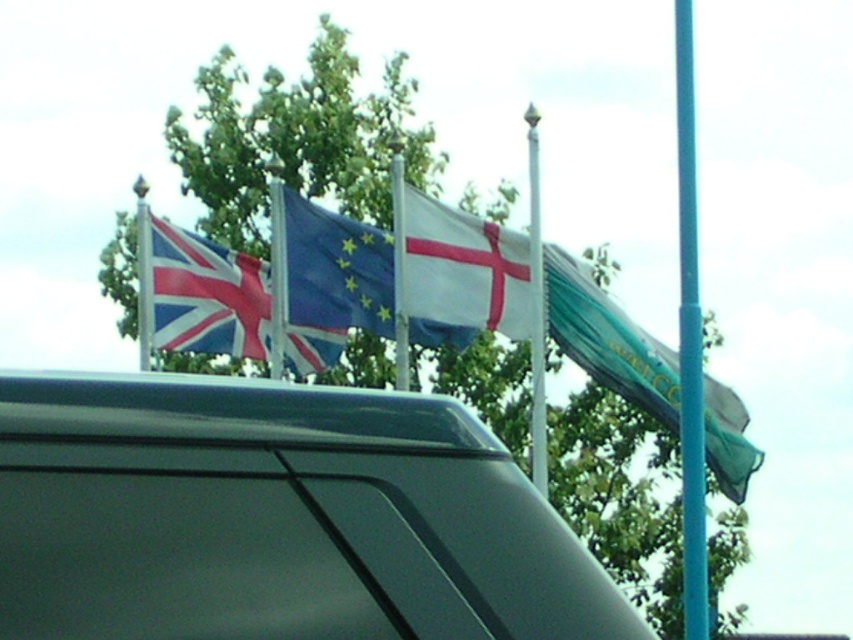
You are standing in front of the row of flagpoles and want to touch the two points mentioned. Which point, point (691, 458) or point (531, 424), is closer to you?

Point (691, 458) is closer to the viewer than point (531, 424).

You are a flag designer observing the row of flags. You need to determine which flag is bigger between the white matte flag at center and the blue fabric flag at center. Which one is larger?

The white matte flag at center is larger in size than the blue fabric flag at center.

In the scene shown: You are standing in front of the row of flagpoles. You notice the white matte flag at center and the silver metallic pole at center. Which object is closer to you?

The white matte flag at center is closer to you because the silver metallic pole at center is behind it.